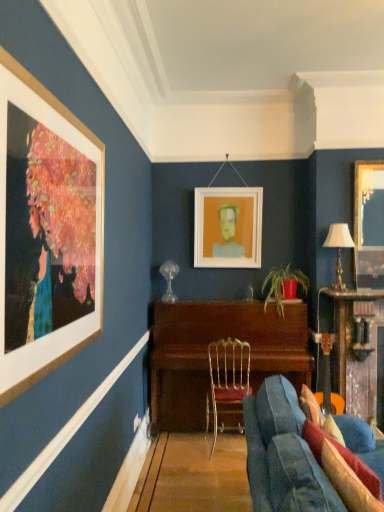
Measure the distance between wooden table at right, positioned as the second table in left-to-right order, and camera.

wooden table at right, positioned as the second table in left-to-right order, is 3.27 meters away from camera.

Identify the location of gold metallic chair at center. (227, 382).

How much space does gold-framed mirror at upper right, which is counted as the first picture frame, starting from the front, occupy vertically?

1.04 meters.

Measure the distance between white matte picture frame at center, placed as the second picture frame when sorted from right to left, and camera.

3.90 meters.

In order to face matte red pot at center, should I rotate leftwards or rightwards?

A 12.392 degree turn to the right will do.

In order to click on wooden table at right, positioned as the second table in left-to-right order in this screenshot , I will do `click(357, 348)`.

From a real-world perspective, which object stands above the other?

In real-world perspective, matte red pot at center is above.

Is matte red pot at center in front of or behind gold metallic chair at center in the image?

matte red pot at center is behind gold metallic chair at center.

Between matte red pot at center and gold metallic chair at center, which one has less height?

matte red pot at center is shorter.

Find the location of a particular element. The image size is (384, 512). houseplant on the right of gold metallic chair at center is located at coordinates coord(283,285).

Considering the positions of objects matte red pot at center and velvet blue couch at lower right in the image provided, who is more to the left, matte red pot at center or velvet blue couch at lower right?

velvet blue couch at lower right is more to the left.

Identify the location of houseplant that is on the right side of velvet blue couch at lower right. (283, 285).

Are matte red pot at center and velvet blue couch at lower right far apart?

matte red pot at center is positioned a significant distance from velvet blue couch at lower right.

How many degrees apart are the facing directions of matte red pot at center and velvet blue couch at lower right?

The angular difference between matte red pot at center and velvet blue couch at lower right is 87.1 degrees.

Is white matte picture frame at center, which appears as the 1th picture frame when viewed from the left, to the left or to the right of gold-framed mirror at upper right, acting as the second picture frame starting from the left, in the image?

white matte picture frame at center, which appears as the 1th picture frame when viewed from the left, is positioned on gold-framed mirror at upper right, acting as the second picture frame starting from the left,'s left side.

In the scene shown: Does white matte picture frame at center, which appears as the 1th picture frame when viewed from the left, have a greater width compared to gold-framed mirror at upper right, acting as the second picture frame starting from the left?

Yes, white matte picture frame at center, which appears as the 1th picture frame when viewed from the left, is wider than gold-framed mirror at upper right, acting as the second picture frame starting from the left.

From a real-world perspective, is white matte picture frame at center, which is the second picture frame in front-to-back order, located beneath gold-framed mirror at upper right, which is counted as the first picture frame, starting from the front?

No.

Can you tell me how much white matte picture frame at center, placed as the second picture frame when sorted from right to left, and gold-framed mirror at upper right, acting as the second picture frame starting from the left, differ in facing direction?

There is a 0.00138-degree angle between the facing directions of white matte picture frame at center, placed as the second picture frame when sorted from right to left, and gold-framed mirror at upper right, acting as the second picture frame starting from the left.

Which object is closer to the camera taking this photo, gold metallic chair at center or velvet blue couch at lower right?

Positioned in front is velvet blue couch at lower right.

Which of these two, gold metallic chair at center or velvet blue couch at lower right, is smaller?

Answer: gold metallic chair at center.

At what (x,y) coordinates should I click in order to perform the action: click on chair behind the velvet blue couch at lower right. Please return your answer as a coordinate pair (x, y). The height and width of the screenshot is (512, 384). Looking at the image, I should click on (227, 382).

From the image's perspective, relative to velvet blue couch at lower right, is gold metallic chair at center above or below?

From the image's perspective, gold metallic chair at center appears above velvet blue couch at lower right.

Does gold metallic table lamp at right appear on the right side of gold metallic chair at center?

Correct, you'll find gold metallic table lamp at right to the right of gold metallic chair at center.

Considering the relative sizes of gold metallic table lamp at right and gold metallic chair at center in the image provided, is gold metallic table lamp at right taller than gold metallic chair at center?

In fact, gold metallic table lamp at right may be shorter than gold metallic chair at center.

From the picture: From the image's perspective, does gold metallic table lamp at right appear higher than gold metallic chair at center?

Indeed, from the image's perspective, gold metallic table lamp at right is shown above gold metallic chair at center.

From a real-world perspective, which is physically above, gold metallic table lamp at right or gold metallic chair at center?

gold metallic table lamp at right, from a real-world perspective.

Looking at this image, could you tell me if matte red pot at center is facing wooden piano at center, placed as the first table when sorted from left to right?

No, matte red pot at center is not turned towards wooden piano at center, placed as the first table when sorted from left to right.

Which of these two, matte red pot at center or wooden piano at center, placed as the first table when sorted from left to right, is smaller?

matte red pot at center.

Is matte red pot at center situated inside wooden piano at center, positioned as the 2th table in right-to-left order, or outside?

matte red pot at center is enclosed within wooden piano at center, positioned as the 2th table in right-to-left order.

How different are the orientations of matte red pot at center and wooden piano at center, placed as the first table when sorted from left to right, in degrees?

The angle between the facing direction of matte red pot at center and the facing direction of wooden piano at center, placed as the first table when sorted from left to right, is 3.14 degrees.

Is wooden table at right, positioned as the second table in left-to-right order, next to gold-framed mirror at upper right, acting as the second picture frame starting from the left?

No, wooden table at right, positioned as the second table in left-to-right order, is not next to gold-framed mirror at upper right, acting as the second picture frame starting from the left.

Is wooden table at right, positioned as the second table in left-to-right order, oriented towards gold-framed mirror at upper right, acting as the second picture frame starting from the left?

No, wooden table at right, positioned as the second table in left-to-right order, does not turn towards gold-framed mirror at upper right, acting as the second picture frame starting from the left.

Between wooden table at right, the 1th table viewed from the right, and gold-framed mirror at upper right, acting as the second picture frame starting from the left, which one has larger width?

wooden table at right, the 1th table viewed from the right, is wider.

This screenshot has height=512, width=384. I want to click on chair that is under the matte red pot at center (from a real-world perspective), so click(x=227, y=382).

This screenshot has width=384, height=512. I want to click on studio couch to the left of matte red pot at center, so click(x=303, y=459).

Looking at the image, which one is located closer to white matte picture frame at center, placed as the second picture frame when sorted from right to left, wooden table at right, the 1th table viewed from the right, or gold metallic chair at center?

gold metallic chair at center is closer to white matte picture frame at center, placed as the second picture frame when sorted from right to left.

Looking at the image, which one is located closer to wooden table at right, positioned as the second table in left-to-right order, gold-framed mirror at upper right, which is counted as the first picture frame, starting from the front, or gold metallic chair at center?

gold-framed mirror at upper right, which is counted as the first picture frame, starting from the front, lies closer to wooden table at right, positioned as the second table in left-to-right order, than the other object.

When comparing their distances from white matte picture frame at center, placed as the second picture frame when sorted from right to left, does gold metallic table lamp at right or matte red pot at center seem further?

gold metallic table lamp at right.

Estimate the real-world distances between objects in this image. Which object is further from gold metallic table lamp at right, gold metallic chair at center or gold-framed mirror at upper right, which is counted as the second picture frame, starting from the back?

gold metallic chair at center.

From the image, which object appears to be farther from wooden table at right, positioned as the second table in left-to-right order, gold metallic table lamp at right or gold metallic chair at center?

Based on the image, gold metallic chair at center appears to be further to wooden table at right, positioned as the second table in left-to-right order.

From the image, which object appears to be nearer to gold metallic chair at center, gold-framed mirror at upper right, the first picture frame positioned from the right, or velvet blue couch at lower right?

Among the two, velvet blue couch at lower right is located nearer to gold metallic chair at center.

When comparing their distances from wooden piano at center, placed as the first table when sorted from left to right, does velvet blue couch at lower right or matte red pot at center seem closer?

matte red pot at center is positioned closer to the anchor wooden piano at center, placed as the first table when sorted from left to right.

Looking at the image, which one is located closer to matte red pot at center, wooden piano at center, placed as the first table when sorted from left to right, or wooden table at right, the 1th table viewed from the right?

Based on the image, wooden piano at center, placed as the first table when sorted from left to right, appears to be nearer to matte red pot at center.

Where is `houseplant between gold-framed mirror at upper right, the first picture frame positioned from the right, and wooden table at right, the 1th table viewed from the right, from top to bottom`? houseplant between gold-framed mirror at upper right, the first picture frame positioned from the right, and wooden table at right, the 1th table viewed from the right, from top to bottom is located at coordinates (283, 285).

Locate an element on the screen. The image size is (384, 512). lamp between white matte picture frame at center, which appears as the 1th picture frame when viewed from the left, and wooden piano at center, positioned as the 2th table in right-to-left order, vertically is located at coordinates (338, 249).

Locate an element on the screen. The height and width of the screenshot is (512, 384). lamp between velvet blue couch at lower right and gold-framed mirror at upper right, which is counted as the first picture frame, starting from the front, from front to back is located at coordinates (338, 249).

This screenshot has height=512, width=384. Identify the location of picture frame between velvet blue couch at lower right and white matte picture frame at center, which is the second picture frame in front-to-back order, from front to back. (369, 224).